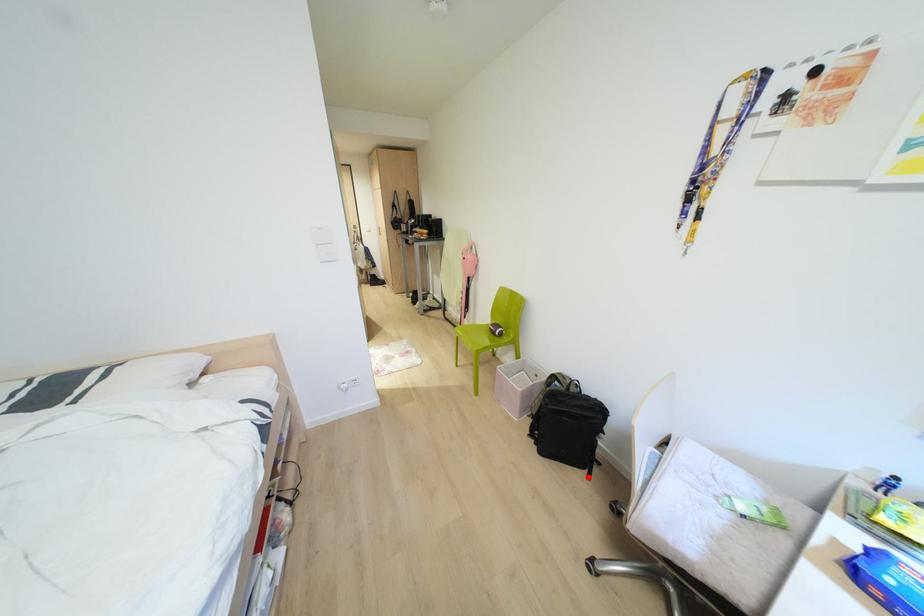
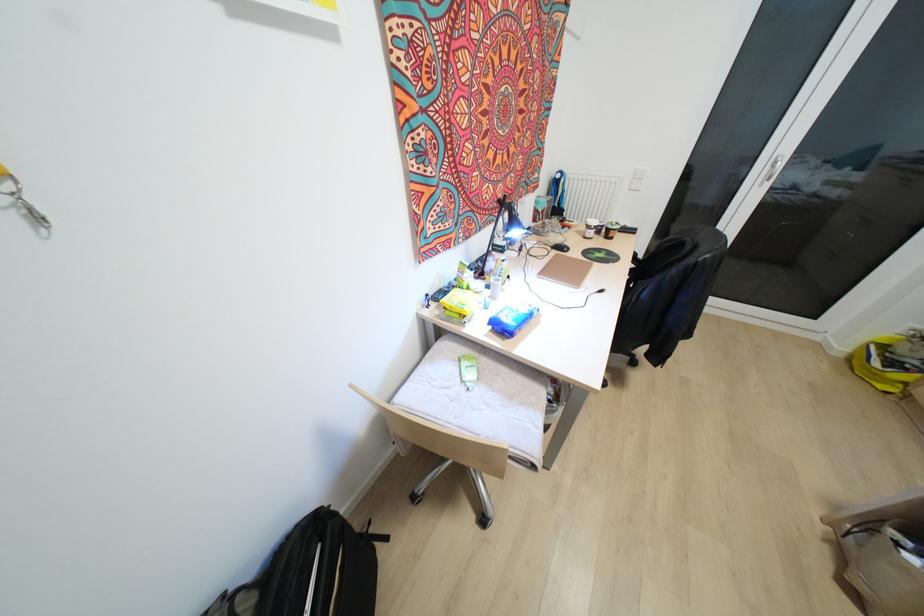
Find the pixel in the second image that matches the highlighted location in the first image.

(385, 538)